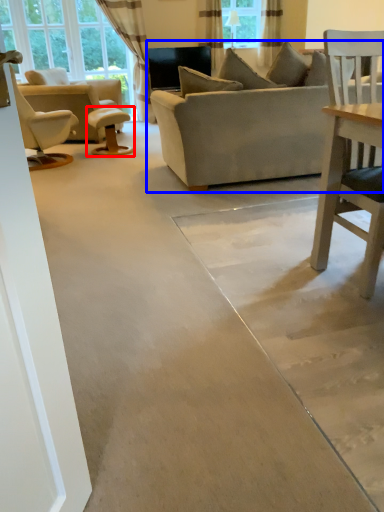
Question: Which object appears farthest to the camera in this image, table (highlighted by a red box) or studio couch (highlighted by a blue box)?

Choices:
 (A) table
 (B) studio couch

Answer: (A)